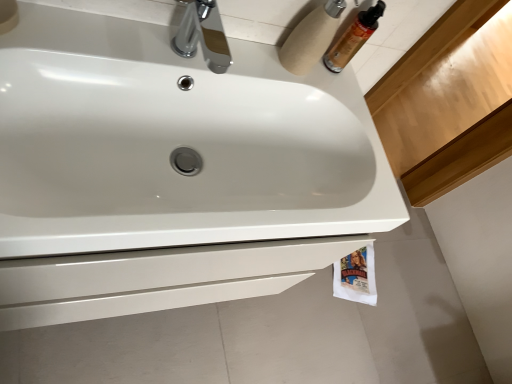
Locate an element on the screen. This screenshot has width=512, height=384. unoccupied region to the right of translucent plastic mouthwash at upper right is located at coordinates (357, 105).